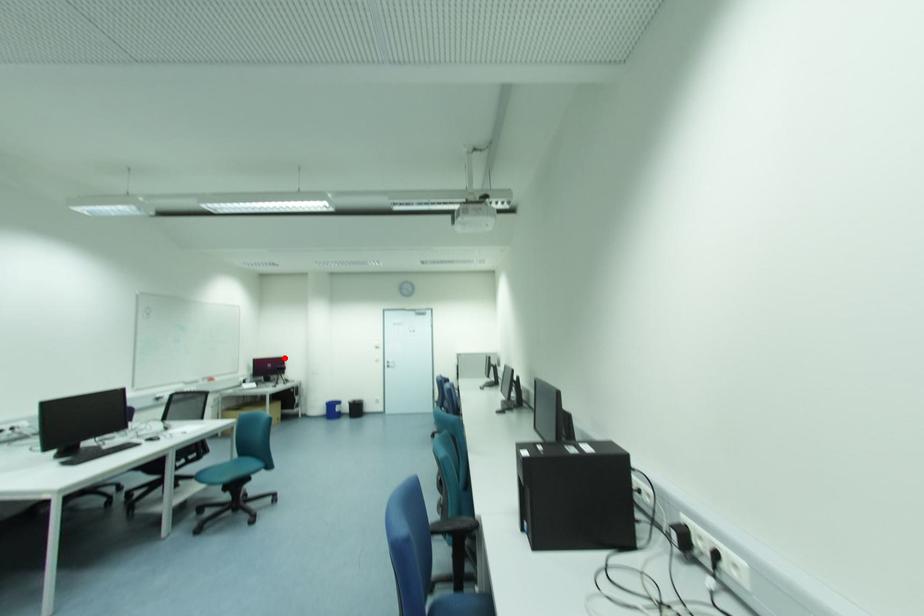
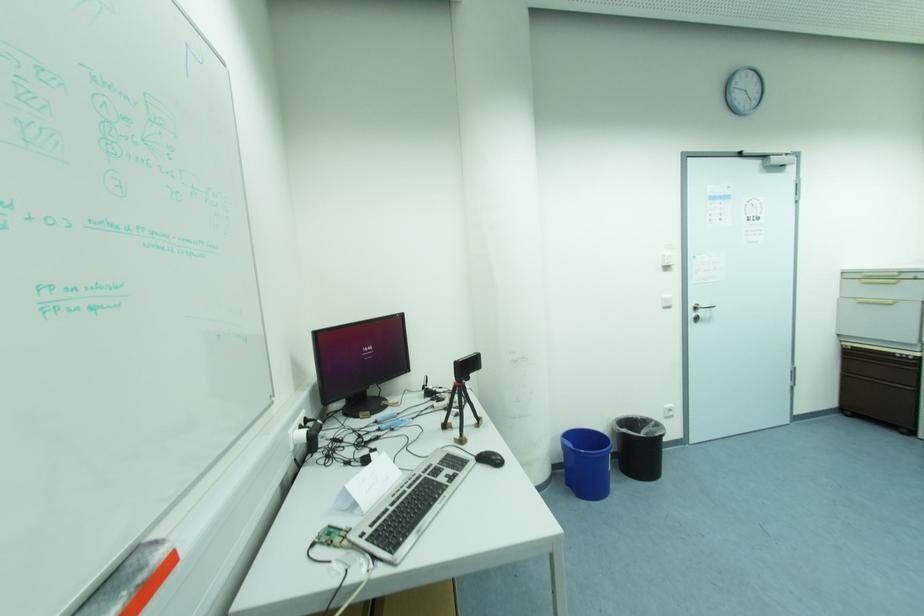
In the second image, find the point that corresponds to the highlighted location in the first image.

(402, 317)